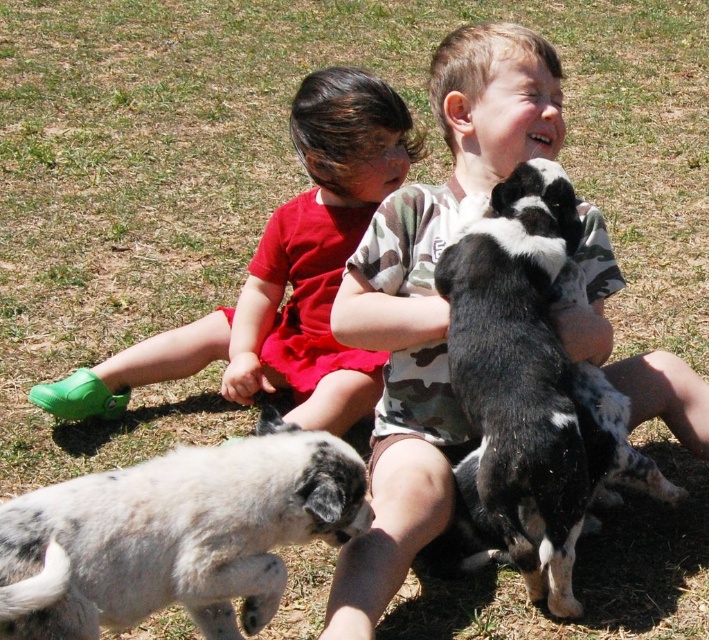
The height and width of the screenshot is (640, 709). What do you see at coordinates (430, 301) in the screenshot?
I see `camouflage fabric shirt at center` at bounding box center [430, 301].

Locate an element on the screen. camouflage fabric shirt at center is located at coordinates (430, 301).

Is point (401, 326) closer to camera compared to point (152, 502)?

That is False.

Find the location of a particular element. This screenshot has width=709, height=640. camouflage fabric shirt at center is located at coordinates (430, 301).

Which is in front, point (496, 451) or point (364, 180)?

Positioned in front is point (496, 451).

I want to click on black and white fur at upper center, so click(x=530, y=387).

Between point (593, 397) and point (301, 150), which one is positioned behind?

Positioned behind is point (301, 150).

Where is `black and white fur at upper center`? black and white fur at upper center is located at coordinates (530, 387).

Can you confirm if camouflage fabric shirt at center is smaller than black and white fur at upper center?

No.

What do you see at coordinates (430, 301) in the screenshot? The height and width of the screenshot is (640, 709). I see `camouflage fabric shirt at center` at bounding box center [430, 301].

This screenshot has height=640, width=709. I want to click on camouflage fabric shirt at center, so click(x=430, y=301).